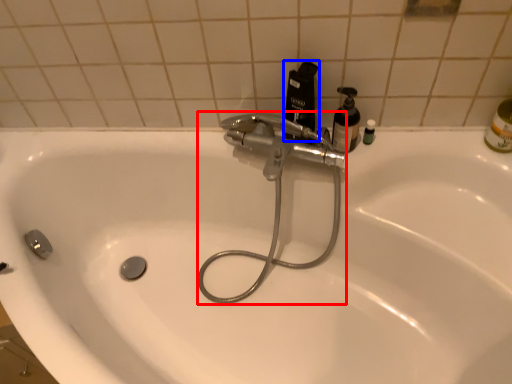
Question: Among these objects, which one is farthest to the camera, plumbing fixture (highlighted by a red box) or cleaning product (highlighted by a blue box)?

Choices:
 (A) plumbing fixture
 (B) cleaning product

Answer: (B)